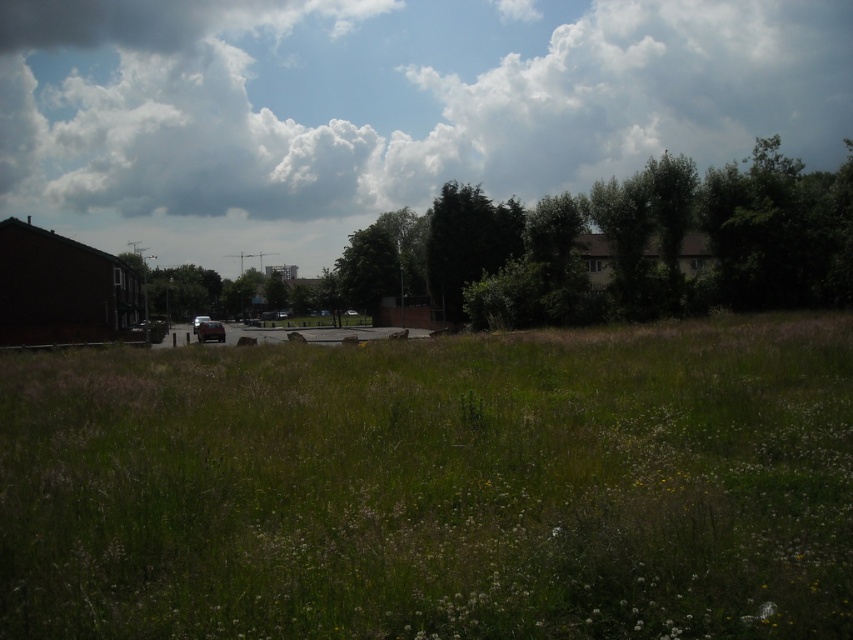
Does point (727, 208) come farther from viewer compared to point (206, 321)?

No, (727, 208) is in front of (206, 321).

Between green leafy tree at upper center and shiny silver car at center, which one appears on the right side from the viewer's perspective?

green leafy tree at upper center

Image resolution: width=853 pixels, height=640 pixels. In order to click on green leafy tree at upper center in this screenshot , I will do `click(625, 244)`.

Is point (490, 252) positioned before point (317, 316)?

Yes, point (490, 252) is closer to viewer.

The image size is (853, 640). What do you see at coordinates (467, 243) in the screenshot? I see `green leafy tree at center` at bounding box center [467, 243].

The height and width of the screenshot is (640, 853). I want to click on green leafy tree at center, so click(x=467, y=243).

Does cloudy sky at upper center have a greater height compared to shiny silver car at center?

Yes.

Is cloudy sky at upper center below shiny silver car at center?

Actually, cloudy sky at upper center is above shiny silver car at center.

Measure the distance between point (705, 44) and camera.

282.55 meters

Where is `cloudy sky at upper center`? The image size is (853, 640). cloudy sky at upper center is located at coordinates (396, 97).